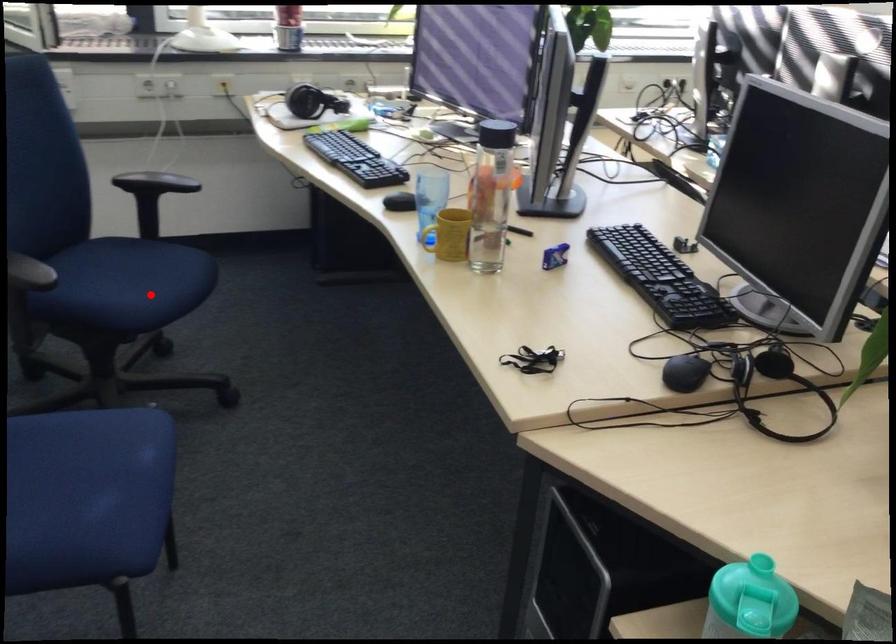
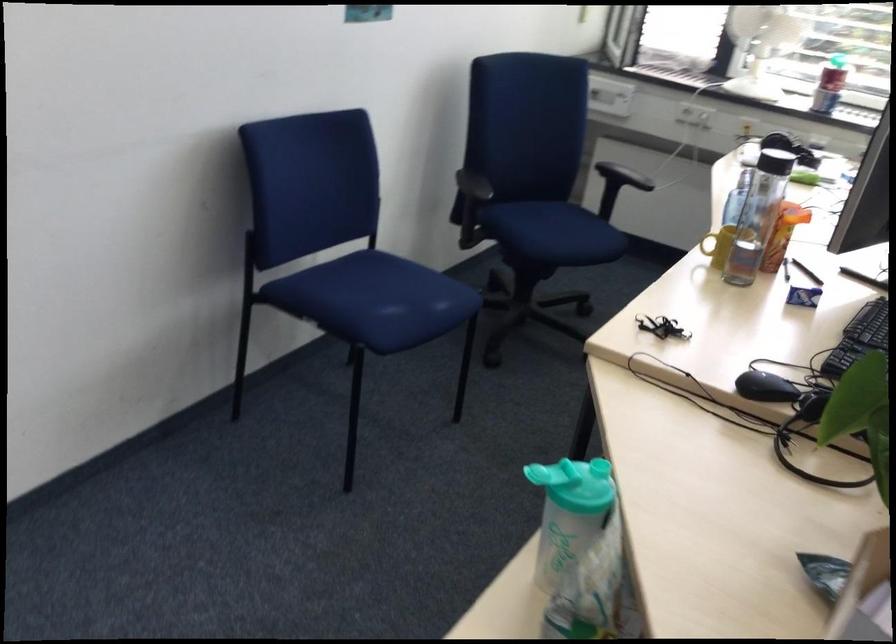
Find the pixel in the second image that matches the highlighted location in the first image.

(553, 232)